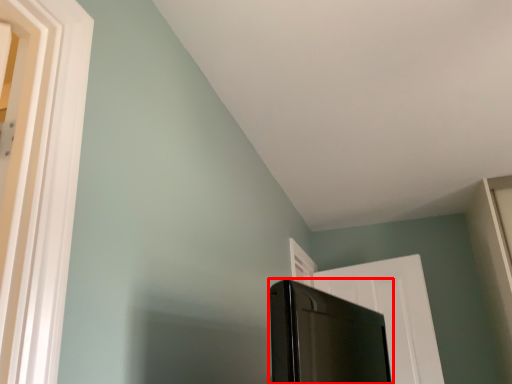
Question: In this image, where is screen door (annotated by the red box) located relative to door?

Choices:
 (A) left
 (B) right

Answer: (A)